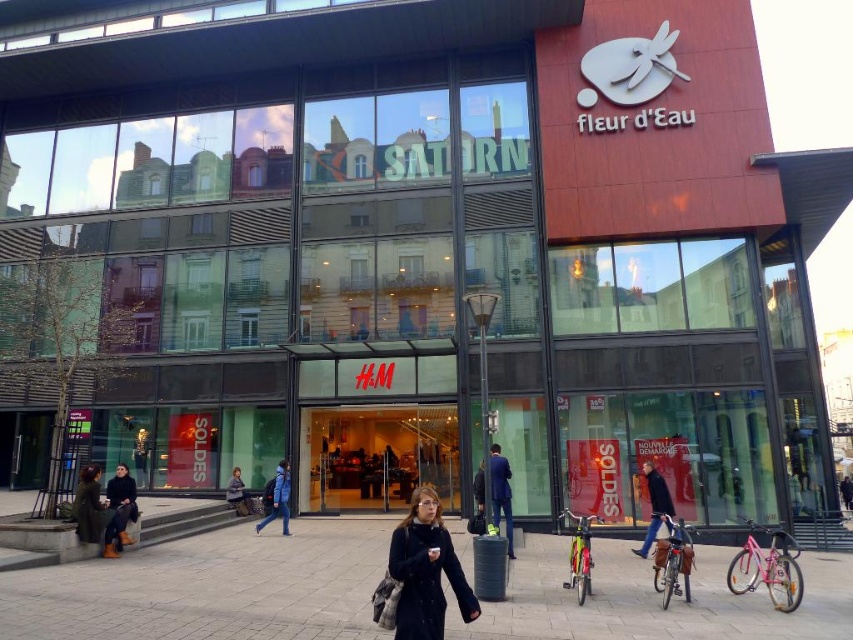
You are a photographer standing at the plaza entrance. You notice a person wearing a blue fabric jacket at center and another wearing a dark gray coat at lower center. Which clothing item is positioned higher in the frame?

The blue fabric jacket at center is located above the dark gray coat at lower center in the frame.

You are a delivery person carrying a heavy box and need to place it on the smooth concrete pavement at center. The box is 3 meters long. Can you safely place the box without overlapping the dark blue jeans at center?

The distance between the smooth concrete pavement at center and dark blue jeans at center is 3.10 meters. Since the box is 3 meters long, it can be placed safely without overlapping as there is enough space.